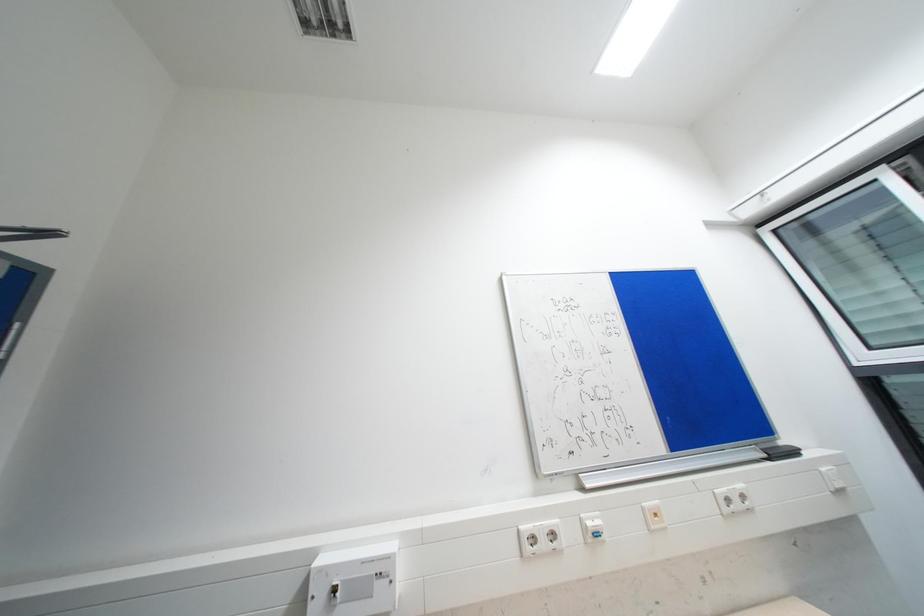
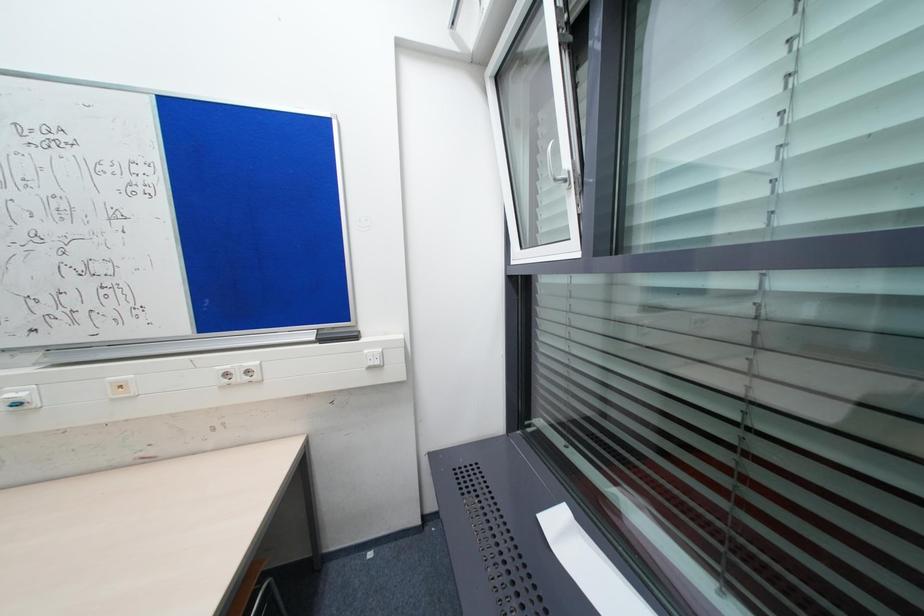
Question: In a continuous first-person perspective shot, in which direction is the camera moving?

Choices:
 (A) Left
 (B) Right
 (C) Forward
 (D) Backward

Answer: (B)